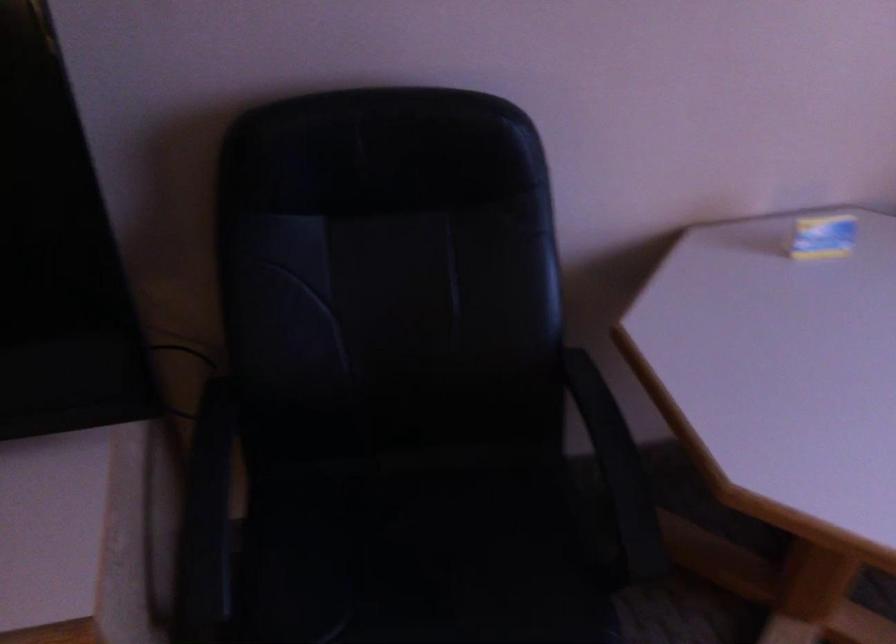
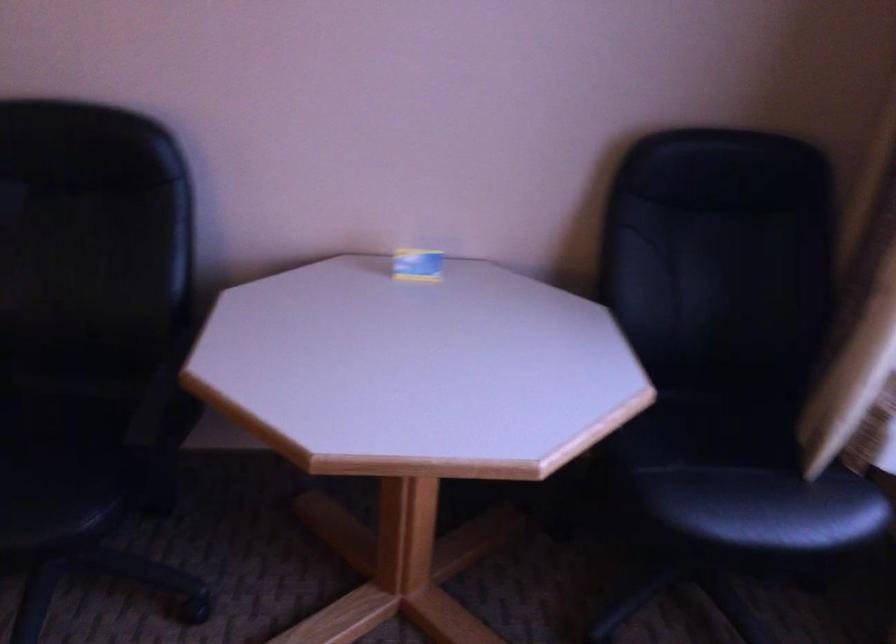
Question: What movement of the cameraman would produce the second image?

Choices:
 (A) Left
 (B) Right
 (C) Forward
 (D) Backward

Answer: (B)